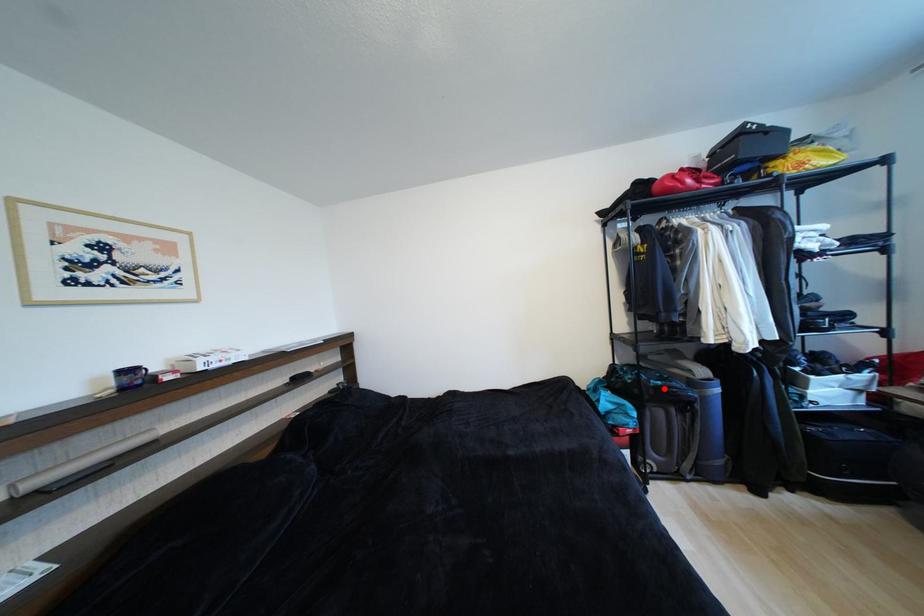
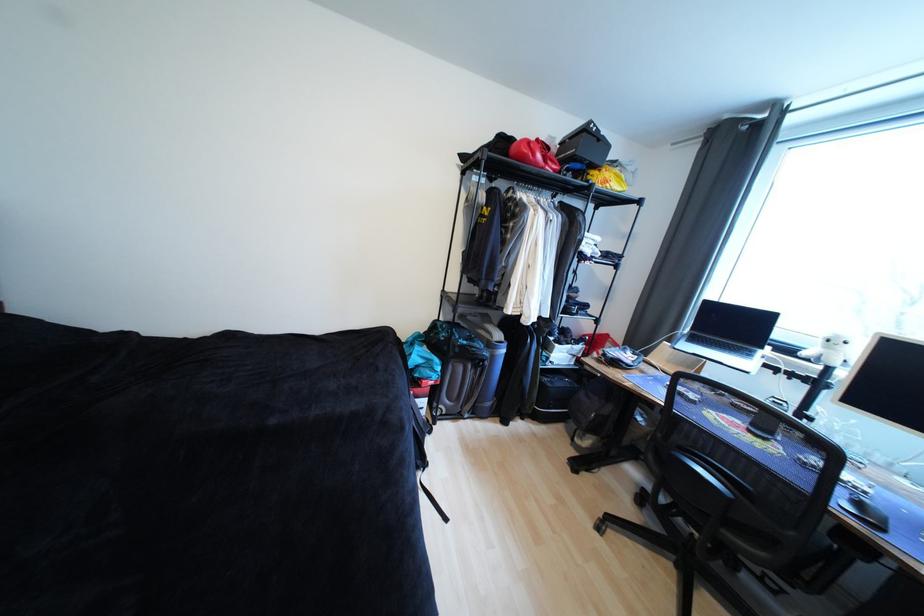
Where in the second image is the point corresponding to the highlighted location from the first image?

(469, 347)